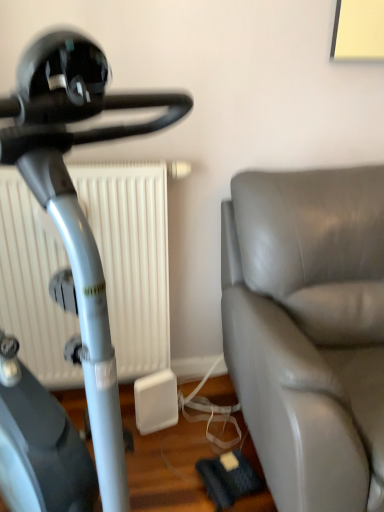
Question: Does matte black stationary bicycle at left have a greater width compared to white matte radiator at center?

Choices:
 (A) no
 (B) yes

Answer: (B)

Question: Considering the relative sizes of matte black stationary bicycle at left and white matte radiator at center in the image provided, is matte black stationary bicycle at left shorter than white matte radiator at center?

Choices:
 (A) no
 (B) yes

Answer: (A)

Question: Is matte black stationary bicycle at left next to white matte radiator at center and touching it?

Choices:
 (A) no
 (B) yes

Answer: (A)

Question: Could you tell me if matte black stationary bicycle at left is turned towards white matte radiator at center?

Choices:
 (A) yes
 (B) no

Answer: (B)

Question: Is the depth of matte black stationary bicycle at left less than that of white matte radiator at center?

Choices:
 (A) no
 (B) yes

Answer: (B)

Question: From a real-world perspective, is white matte radiator at center above or below gray leather couch at right?

Choices:
 (A) above
 (B) below

Answer: (A)

Question: Is white matte radiator at center inside the boundaries of gray leather couch at right, or outside?

Choices:
 (A) outside
 (B) inside

Answer: (A)

Question: From the image's perspective, is white matte radiator at center located above or below gray leather couch at right?

Choices:
 (A) above
 (B) below

Answer: (A)

Question: Does point (152, 343) appear closer or farther from the camera than point (301, 430)?

Choices:
 (A) farther
 (B) closer

Answer: (A)

Question: Based on their sizes in the image, would you say gray leather couch at right is bigger or smaller than white matte radiator at center?

Choices:
 (A) small
 (B) big

Answer: (B)

Question: Is gray leather couch at right spatially inside white matte radiator at center, or outside of it?

Choices:
 (A) outside
 (B) inside

Answer: (A)

Question: From the image's perspective, is gray leather couch at right positioned above or below white matte radiator at center?

Choices:
 (A) above
 (B) below

Answer: (B)

Question: Would you say gray leather couch at right is to the left or to the right of white matte radiator at center in the picture?

Choices:
 (A) right
 (B) left

Answer: (A)

Question: Considering the positions of gray leather couch at right and matte black stationary bicycle at left in the image, is gray leather couch at right taller or shorter than matte black stationary bicycle at left?

Choices:
 (A) tall
 (B) short

Answer: (B)

Question: From the image's perspective, relative to matte black stationary bicycle at left, is gray leather couch at right above or below?

Choices:
 (A) above
 (B) below

Answer: (B)